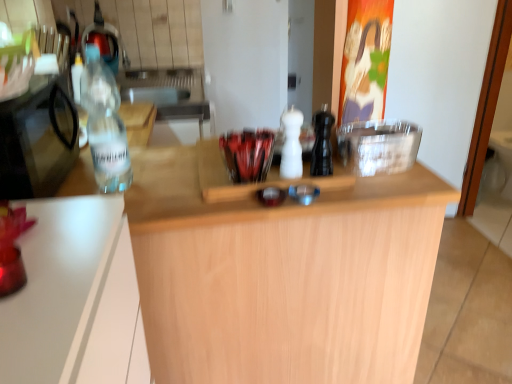
Question: Based on their positions, is transparent plastic bottle at left, the second appliance viewed from the right, located to the left or right of white matte salt shaker at center, placed as the second bottle when sorted from right to left?

Choices:
 (A) right
 (B) left

Answer: (B)

Question: Is transparent plastic bottle at left, the first appliance from the left, taller or shorter than white matte salt shaker at center, placed as the second bottle when sorted from right to left?

Choices:
 (A) short
 (B) tall

Answer: (B)

Question: Which of these objects is positioned closest to the black matte pepper grinder at center, arranged as the first bottle when viewed from the right?

Choices:
 (A) clear plastic container at center, the first appliance from the right
 (B) white matte salt shaker at center, placed as the second bottle when sorted from right to left
 (C) clear glass bottle at left, the 3th bottle positioned from the right
 (D) light wood countertop at center
 (E) transparent plastic bottle at left, the first appliance from the left

Answer: (B)

Question: Which object is positioned closest to the light wood countertop at center?

Choices:
 (A) transparent plastic bottle at left, the first appliance from the left
 (B) white matte salt shaker at center, placed as the second bottle when sorted from right to left
 (C) black matte pepper grinder at center, arranged as the first bottle when viewed from the right
 (D) clear glass bottle at left, the first bottle in the left-to-right sequence
 (E) clear plastic container at center, the first appliance from the right

Answer: (C)